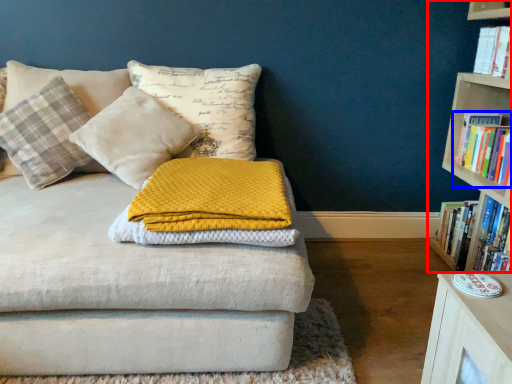
Question: Which object is closer to the camera taking this photo, bookcase (highlighted by a red box) or book (highlighted by a blue box)?

Choices:
 (A) bookcase
 (B) book

Answer: (A)